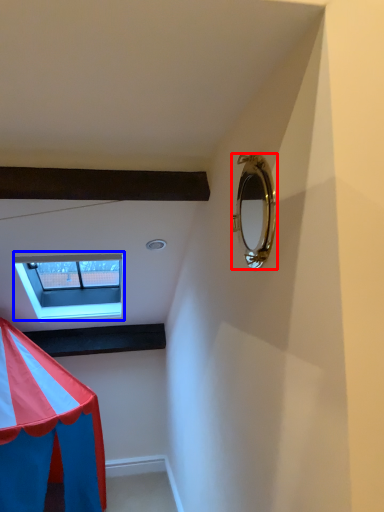
Question: Which object appears closest to the camera in this image, mirror (highlighted by a red box) or window (highlighted by a blue box)?

Choices:
 (A) mirror
 (B) window

Answer: (A)